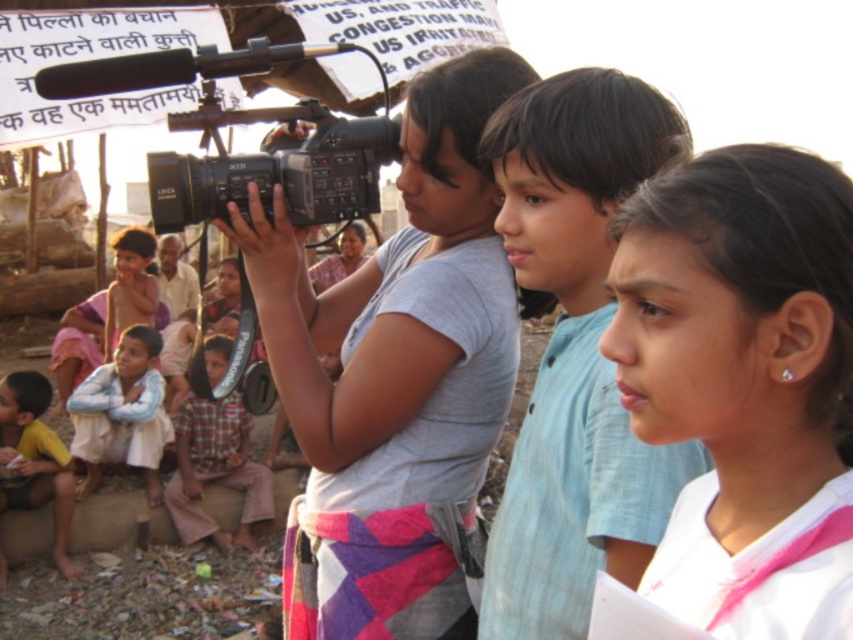
Question: Which object is farther from the camera taking this photo?

Choices:
 (A) yellow cotton shirt at lower left
 (B) plaid fabric shirt at lower left

Answer: (A)

Question: Estimate the real-world distances between objects in this image. Which object is farther from the gray cotton shirt at center?

Choices:
 (A) plaid fabric shirt at lower left
 (B) light blue denim jacket at lower left

Answer: (B)

Question: Can you confirm if white fabric at center is smaller than gray cotton shirt at center?

Choices:
 (A) yes
 (B) no

Answer: (A)

Question: Which of the following is the closest to the observer?

Choices:
 (A) black plastic video camera at upper left
 (B) yellow cotton shirt at lower left
 (C) light blue cotton shirt at center
 (D) gray cotton shirt at center

Answer: (C)

Question: Observing the image, what is the correct spatial positioning of plaid fabric shirt at lower left in reference to light blue denim jacket at lower left?

Choices:
 (A) above
 (B) below

Answer: (A)

Question: Where is plaid fabric shirt at lower left located in relation to light blue denim jacket at lower left in the image?

Choices:
 (A) below
 (B) above

Answer: (B)